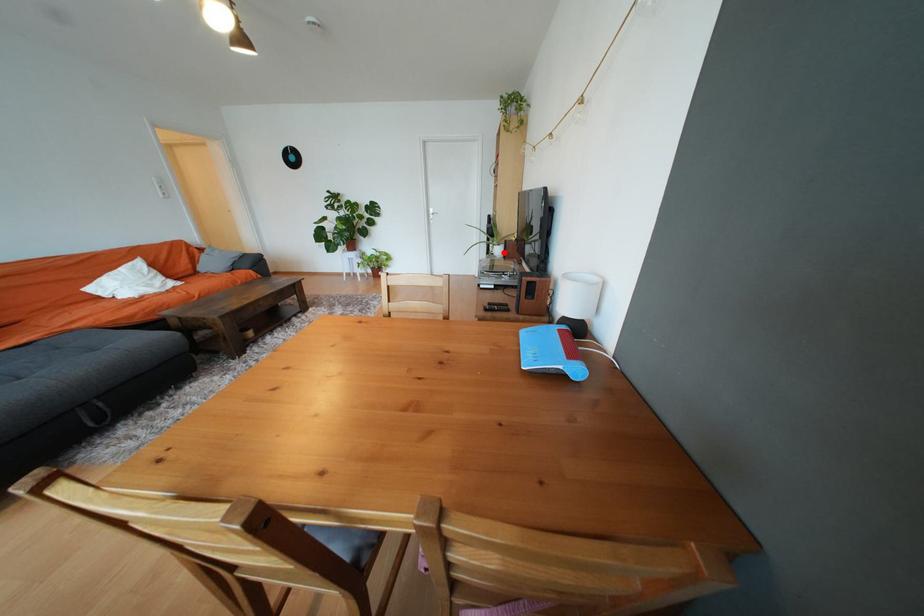
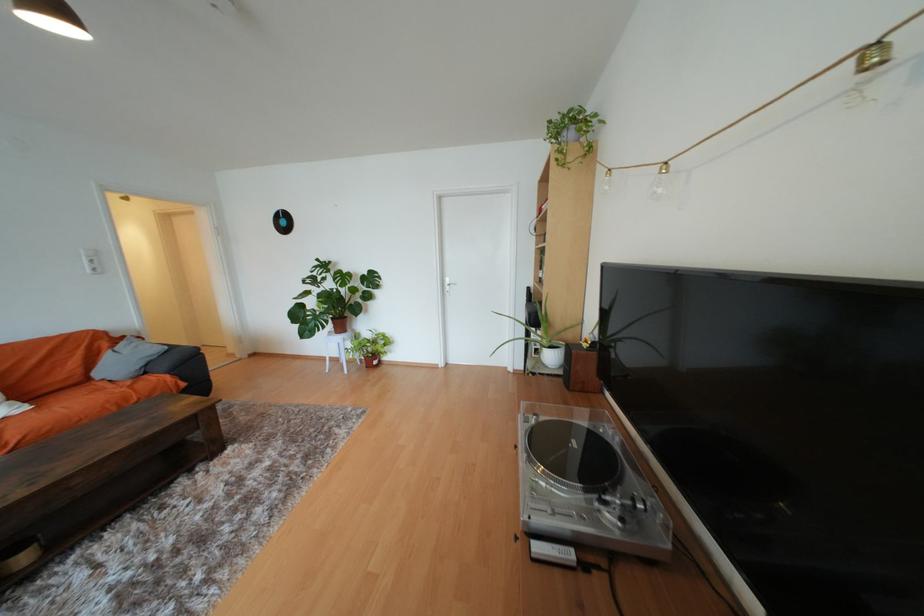
Question: A red point is marked in image1. In image2, is the corresponding 3D point closer to the camera or farther? Reply with the corresponding letter.

Choices:
 (A) The corresponding 3D point is closer.
 (B) The corresponding 3D point is farther.

Answer: (B)